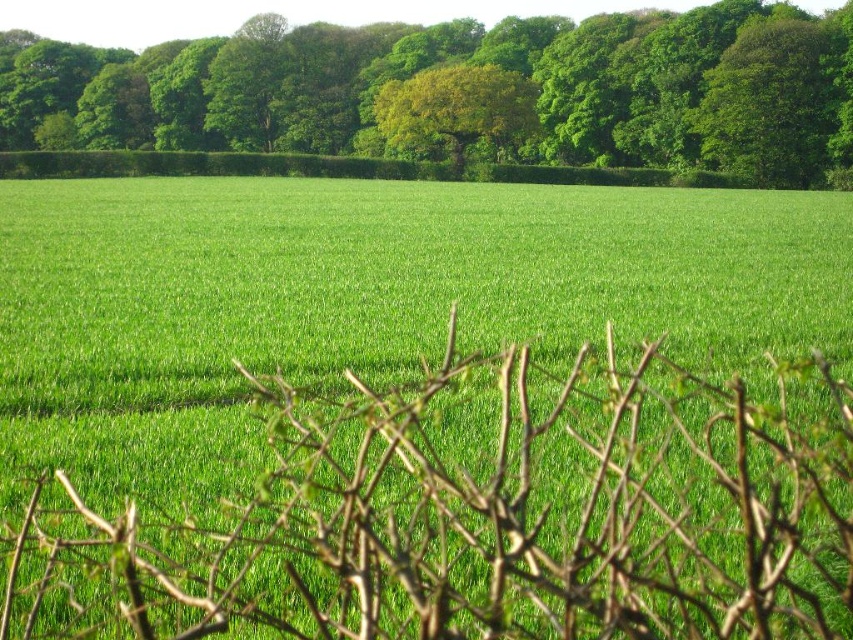
You are standing in the rural landscape and want to take a photo of both the green grass at center and the green leafy tree at upper center. Which object will appear larger in the photo?

The green grass at center will appear larger in the photo because it is closer to the viewer than the green leafy tree at upper center.

You are a farmer checking the growth of your crops. You notice the green grass at center and the green leafy tree at upper center in your field. Which one is taller?

The green leafy tree at upper center is taller than the green grass at center.

You are standing in the middle of the green grass at center and want to walk towards the green leafy tree at upper center. Which direction should you move to reach it?

To reach the green leafy tree at upper center from the green grass at center, you should move to the left since the green grass at center is to the right of the green leafy tree at upper center.